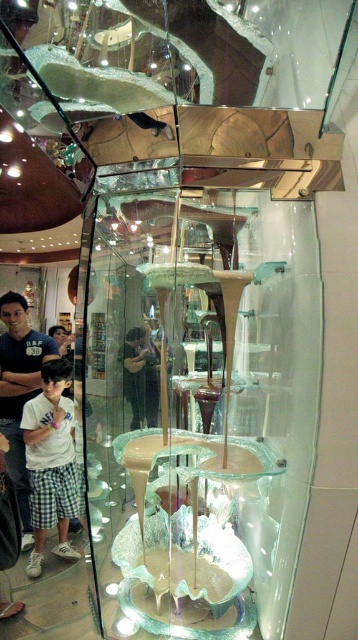
Does white cotton shirt at left appear on the left side of translucent glass bowl at center?

Correct, you'll find white cotton shirt at left to the left of translucent glass bowl at center.

Which is behind, point (45, 358) or point (176, 532)?

The point (45, 358) is more distant.

I want to click on white cotton shirt at left, so click(x=20, y=392).

In the scene shown: Does translucent glass sculpture at center have a lesser height compared to white cotton shirt at left?

No, translucent glass sculpture at center is not shorter than white cotton shirt at left.

This screenshot has width=358, height=640. Find the location of `translucent glass sculpture at center`. translucent glass sculpture at center is located at coordinates (197, 406).

Is point (224, 371) positioned behind point (22, 307)?

No, (224, 371) is closer to viewer.

Where is `translucent glass sculpture at center`? translucent glass sculpture at center is located at coordinates (x=197, y=406).

Where is `translucent glass sculpture at center`? The image size is (358, 640). translucent glass sculpture at center is located at coordinates (197, 406).

Between translucent glass sculpture at center and translucent glass bowl at center, which one is positioned higher?

translucent glass sculpture at center

At what (x,y) coordinates should I click in order to perform the action: click on translucent glass sculpture at center. Please return your answer as a coordinate pair (x, y). This screenshot has height=640, width=358. Looking at the image, I should click on (197, 406).

Locate an element on the screen. The height and width of the screenshot is (640, 358). translucent glass sculpture at center is located at coordinates (197, 406).